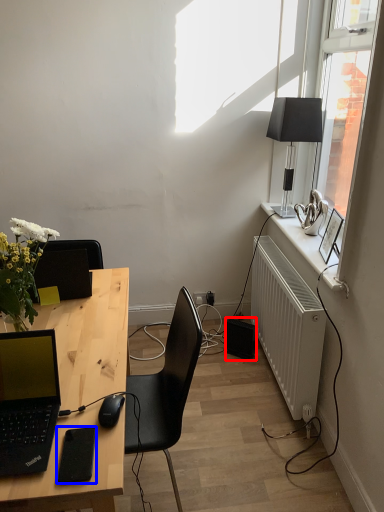
Question: Which point is closer to the camera, speaker (highlighted by a red box) or gadget (highlighted by a blue box)?

Choices:
 (A) speaker
 (B) gadget

Answer: (B)